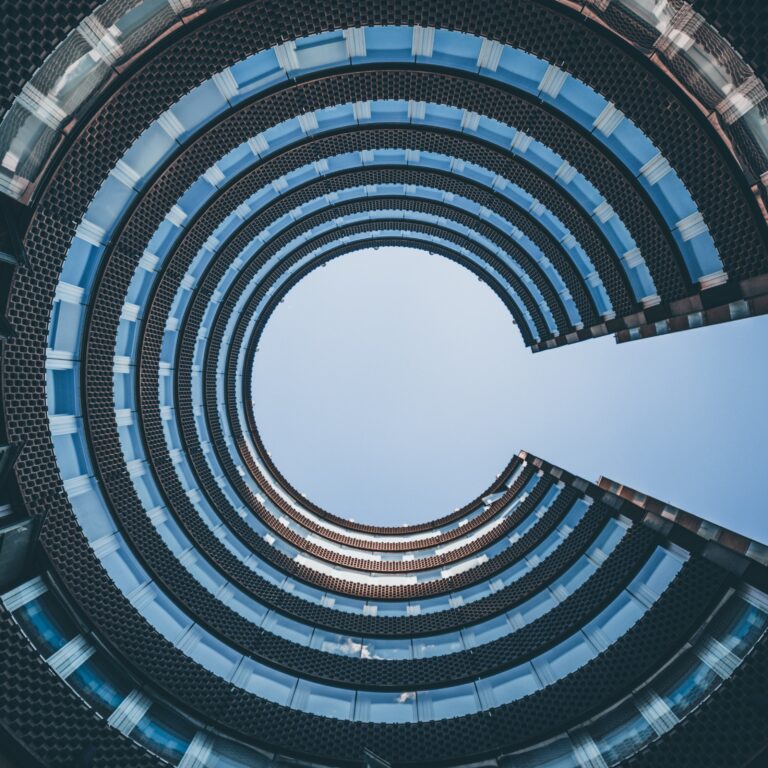
This screenshot has width=768, height=768. I want to click on rows between windows, so click(x=409, y=246), click(x=424, y=227), click(x=431, y=209), click(x=452, y=187), click(x=437, y=144), click(x=389, y=87), click(x=389, y=15), click(x=31, y=15).